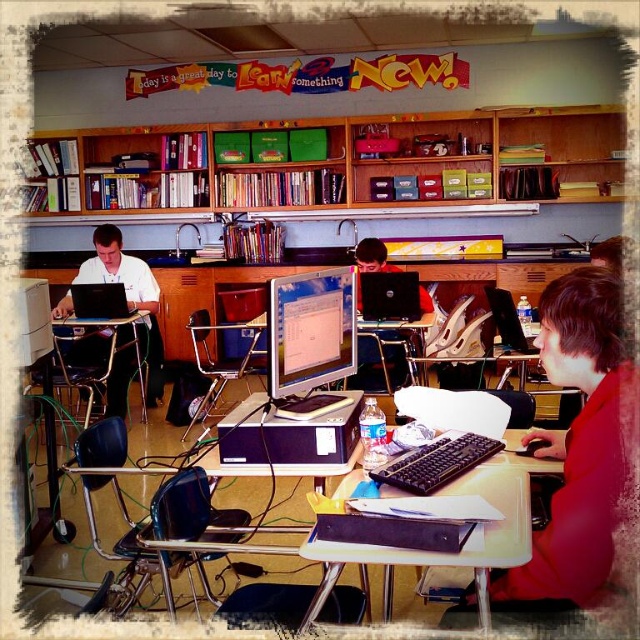
Looking at this image, you are a student trying to reach the matte black laptop at left on your desk while sitting at the matte white shirt at left. Can you easily access it without moving your chair?

The matte white shirt at left is further to the viewer than the matte black laptop at left, so you are sitting closer to your own body and the laptop is farther away. You might need to stretch or move your chair to reach it.

You are a student who needs to place a tall stack of books on the desk. Considering the height of the matte black monitor at center and the matte black desk at left, will the stack of books fit on the desk without the monitor blocking it?

The matte black monitor at center is not as tall as the matte black desk at left, so the stack of books may not fit on the desk without the monitor blocking it because the desk is taller than the monitor.

You are a student in this classroom and you want to place a new textbook on the desk. Considering the sizes of the matte white shirt at left and the matte black desktop computer at center, which object should you avoid placing the textbook near to ensure it doesn

The matte white shirt at left is bigger than the matte black desktop computer at center, so you should avoid placing the textbook near the matte white shirt at left to ensure there is enough space.